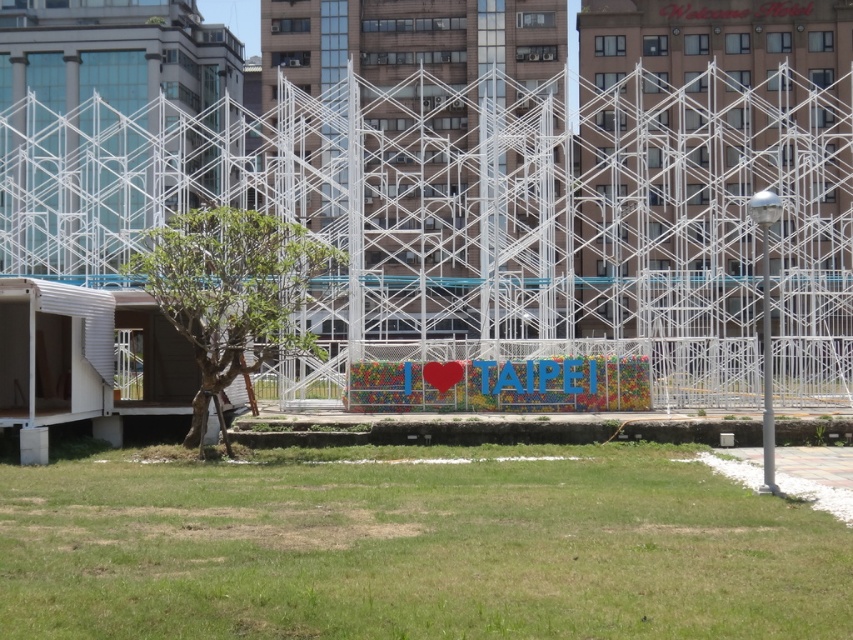
Consider the image. You are a city planner evaluating the urban space. You need to determine if the green grass at lower center is visible from the top of the white metallic scaffolding at center. Based on their heights, can you see the grass from there?

The white metallic scaffolding at center is much taller than the green grass at lower center, so from the top of the scaffolding, you would be able to see the green grass at lower center as it is lower in height.

You are a city planner assessing the urban space. You need to determine if the green leafy tree at left can be relocated without affecting the structural integrity of the white metallic scaffolding at center. Based on their sizes, is this feasible?

The white metallic scaffolding at center is bigger than the green leafy tree at left, so the tree can be relocated without affecting the structural integrity of the scaffolding.

You are a landscape architect planning to install a new pathway. You see the white metallic scaffolding at center and the green grass at lower center. Which object is located to the right of the other?

The white metallic scaffolding at center is positioned on the right side of green grass at lower center.